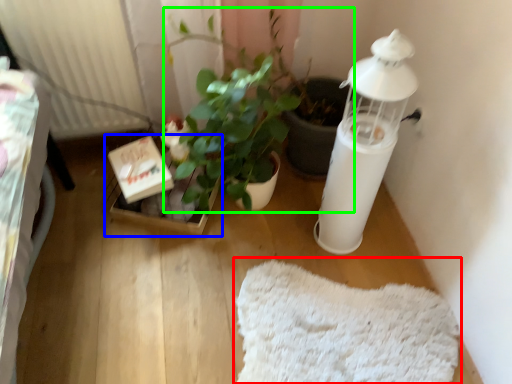
Question: Which is nearer to the mat (highlighted by a red box)? cardboard box (highlighted by a blue box) or houseplant (highlighted by a green box).

Choices:
 (A) cardboard box
 (B) houseplant

Answer: (B)